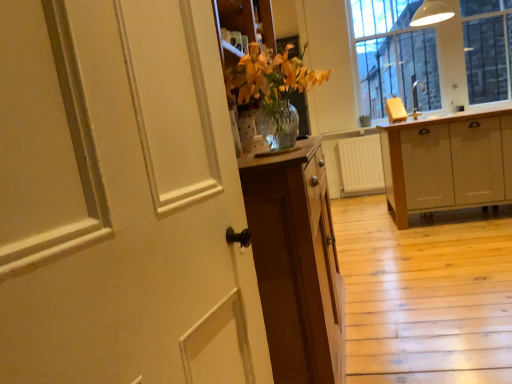
Question: Based on their positions, is clear glass window at upper right located to the left or right of matte silver faucet at upper right?

Choices:
 (A) left
 (B) right

Answer: (B)

Question: From their relative heights in the image, would you say clear glass window at upper right is taller or shorter than matte silver faucet at upper right?

Choices:
 (A) short
 (B) tall

Answer: (B)

Question: Which of these objects is positioned closest to the clear glass window at upper right?

Choices:
 (A) matte silver faucet at upper right
 (B) light wood cabinet at right
 (C) white painted wood door at left

Answer: (A)

Question: Based on their relative distances, which object is nearer to the matte silver faucet at upper right?

Choices:
 (A) light wood cabinet at right
 (B) clear glass window at upper right
 (C) white painted wood door at left

Answer: (B)